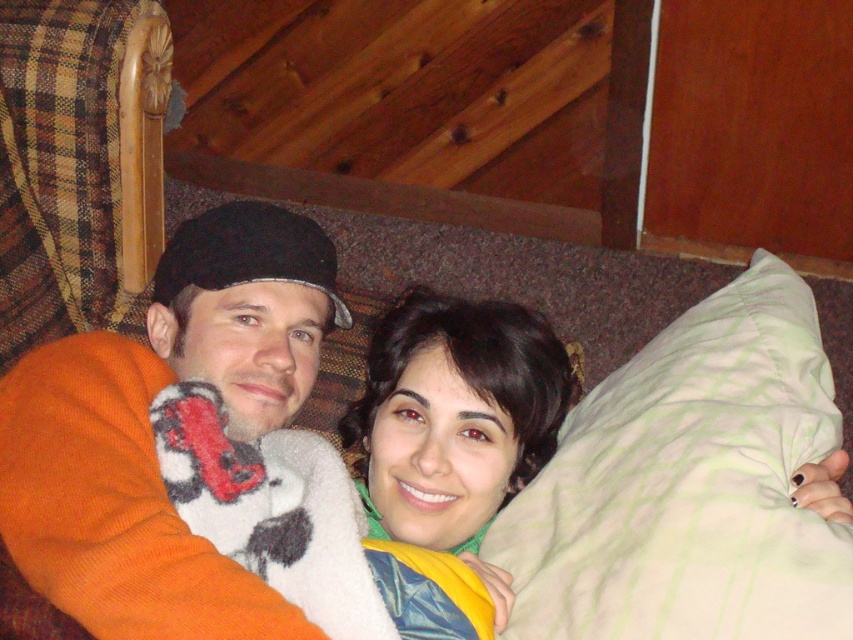
In the scene shown: Is orange fuzzy sweater at left above dark brown hair at center?

Indeed, orange fuzzy sweater at left is positioned over dark brown hair at center.

Does orange fuzzy sweater at left lie behind dark brown hair at center?

No, orange fuzzy sweater at left is in front of dark brown hair at center.

Describe the element at coordinates (151, 433) in the screenshot. I see `orange fuzzy sweater at left` at that location.

Locate an element on the screen. The image size is (853, 640). orange fuzzy sweater at left is located at coordinates (151, 433).

Describe the element at coordinates (151, 433) in the screenshot. This screenshot has height=640, width=853. I see `orange fuzzy sweater at left` at that location.

Which is more to the right, orange fuzzy sweater at left or orange knit sweater at center?

orange knit sweater at center is more to the right.

What do you see at coordinates (151, 433) in the screenshot?
I see `orange fuzzy sweater at left` at bounding box center [151, 433].

In order to click on orange fuzzy sweater at left in this screenshot , I will do `click(151, 433)`.

Which is more to the left, green striped pillow at lower right or dark brown hair at center?

From the viewer's perspective, dark brown hair at center appears more on the left side.

The height and width of the screenshot is (640, 853). What do you see at coordinates (689, 484) in the screenshot?
I see `green striped pillow at lower right` at bounding box center [689, 484].

Is point (595, 611) closer to viewer compared to point (440, 531)?

That is True.

Where is `green striped pillow at lower right`? green striped pillow at lower right is located at coordinates (689, 484).